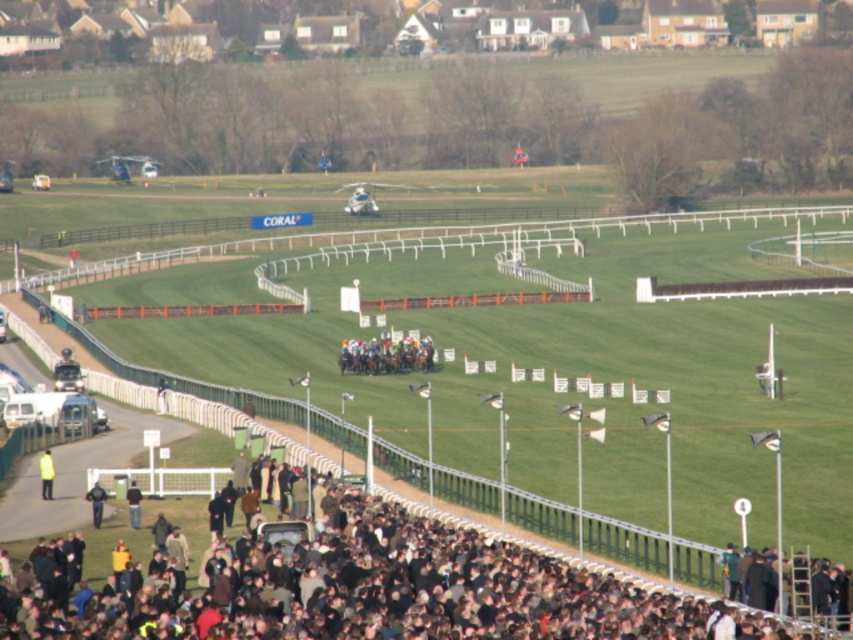
You are a photographer at the horse racing event. You need to capture a photo of the crowd while ensuring both the dark brown fur coat at lower center and the neon yellow jacket at lower left are visible. Which object should you focus on to ensure both are in frame?

The dark brown fur coat at lower center is taller than the neon yellow jacket at lower left. To ensure both are in frame, focus on the dark brown fur coat at lower center as it is taller and will be more visible, allowing the shorter neon yellow jacket at lower left to also be captured in the photo.

You are a photographer standing at the edge of the horse racing track. You want to capture a photo of both the neon yellow jacket at lower left and the dark gray jacket at lower center in the same frame. However, your camera has a limited field of view. Based on their positions, can you fit both jackets into the frame without moving your position?

The neon yellow jacket at lower left might be wider than dark gray jacket at lower center, so there is a possibility that both can be captured in the frame if the camera has enough horizontal coverage. However, the exact distance between them is not specified, so it depends on the camera settings and focal length.